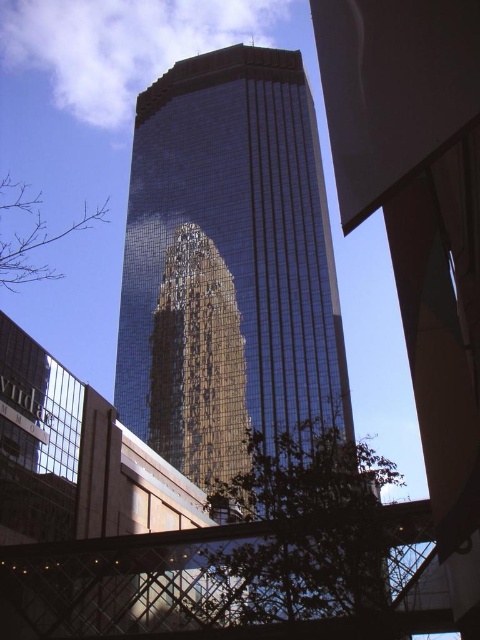
You are standing in the urban area looking at the skyscraper. You see a green leafy tree at lower center and a bare branches at lower left. Which one is positioned to the right side?

The green leafy tree at lower center is positioned to the right of the bare branches at lower left.

You are a drone operator trying to deliver a package to the shiny glass tower at center. Your GPS shows a point at coordinates (228, 266). Is this point likely to be on the shiny glass tower at center?

Yes, the point at coordinates (228, 266) marks the shiny glass tower at center, so it is likely on the tower.

You are a drone operator who needs to fly a drone from the shiny glass tower at center to the green leafy tree at lower center. The drone has a maximum flight distance of 100 feet. Can the drone successfully reach the tree?

The shiny glass tower at center and green leafy tree at lower center are 98.91 feet apart from each other. Since the distance is less than the drone maximum flight distance of 100 feet, the drone can successfully reach the tree.